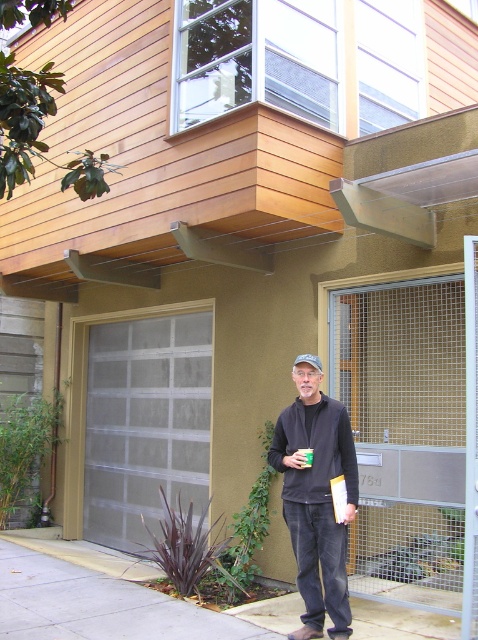
You are a delivery person trying to deliver a package to the gray textured garage door at center. However, there is a black matte jacket at center blocking the entrance. Can you fit through the space between them?

The gray textured garage door at center is wider than the black matte jacket at center, so there is enough space to fit through the gap between them for delivery.